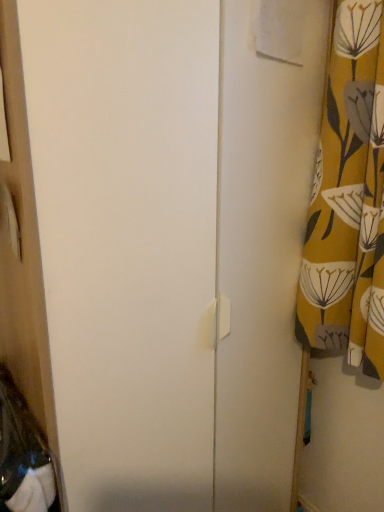
In order to face yellow floral fabric at right, should I rotate leftwards or rightwards?

A 21.200 degree turn to the right will do.

I want to click on yellow floral fabric at right, so click(x=348, y=198).

What is the approximate width of yellow floral fabric at right?

It is 5.99 inches.

What do you see at coordinates (348, 198) in the screenshot? I see `yellow floral fabric at right` at bounding box center [348, 198].

The width and height of the screenshot is (384, 512). What do you see at coordinates (127, 241) in the screenshot?
I see `white matte screen door at center` at bounding box center [127, 241].

Image resolution: width=384 pixels, height=512 pixels. I want to click on white matte screen door at center, so coord(127,241).

Locate an element on the screen. This screenshot has height=512, width=384. yellow floral fabric at right is located at coordinates (348, 198).

Is white matte screen door at center to the right of yellow floral fabric at right from the viewer's perspective?

No, white matte screen door at center is not to the right of yellow floral fabric at right.

Considering the positions of objects white matte screen door at center and yellow floral fabric at right in the image provided, who is behind, white matte screen door at center or yellow floral fabric at right?

yellow floral fabric at right is more distant.

Which is in front, point (119, 274) or point (336, 114)?

The point (119, 274) is more forward.

From the image's perspective, between white matte screen door at center and yellow floral fabric at right, which one is located above?

From the image's view, yellow floral fabric at right is above.

From a real-world perspective, is white matte screen door at center located beneath yellow floral fabric at right?

Yes, from a real-world perspective, white matte screen door at center is under yellow floral fabric at right.

Does white matte screen door at center have a greater width compared to yellow floral fabric at right?

Indeed, white matte screen door at center has a greater width compared to yellow floral fabric at right.

Does white matte screen door at center have a lesser height compared to yellow floral fabric at right?

Incorrect, the height of white matte screen door at center does not fall short of that of yellow floral fabric at right.

Does white matte screen door at center have a smaller size compared to yellow floral fabric at right?

No.

Do you think white matte screen door at center is within yellow floral fabric at right, or outside of it?

white matte screen door at center cannot be found inside yellow floral fabric at right.

Are white matte screen door at center and yellow floral fabric at right making contact?

No.

Is white matte screen door at center positioned with its back to yellow floral fabric at right?

No, white matte screen door at center's orientation is not away from yellow floral fabric at right.

What's the angular difference between white matte screen door at center and yellow floral fabric at right's facing directions?

91.4 degrees.

The width and height of the screenshot is (384, 512). I want to click on curtain that appears on the right of white matte screen door at center, so click(348, 198).

Looking at this image, visually, is yellow floral fabric at right positioned to the left or to the right of white matte screen door at center?

Based on their positions, yellow floral fabric at right is located to the right of white matte screen door at center.

Is yellow floral fabric at right positioned in front of white matte screen door at center?

No, it is not.

Between point (368, 110) and point (207, 60), which one is positioned in front?

The point (207, 60) is closer to the camera.

From the image's perspective, is yellow floral fabric at right located above or below white matte screen door at center?

From the image's perspective, yellow floral fabric at right appears above white matte screen door at center.

From a real-world perspective, is yellow floral fabric at right positioned over white matte screen door at center based on gravity?

Yes, from a real-world perspective, yellow floral fabric at right is on top of white matte screen door at center.

Does yellow floral fabric at right have a lesser width compared to white matte screen door at center?

Correct, the width of yellow floral fabric at right is less than that of white matte screen door at center.

Considering the sizes of objects yellow floral fabric at right and white matte screen door at center in the image provided, who is taller, yellow floral fabric at right or white matte screen door at center?

Standing taller between the two is white matte screen door at center.

Who is bigger, yellow floral fabric at right or white matte screen door at center?

Bigger between the two is white matte screen door at center.

Is yellow floral fabric at right not inside white matte screen door at center?

Indeed, yellow floral fabric at right is completely outside white matte screen door at center.

Would you say yellow floral fabric at right is a long distance from white matte screen door at center?

No, yellow floral fabric at right is not far away from white matte screen door at center.

Is yellow floral fabric at right aimed at white matte screen door at center?

No, yellow floral fabric at right is not aimed at white matte screen door at center.

The height and width of the screenshot is (512, 384). I want to click on screen door in front of the yellow floral fabric at right, so click(x=127, y=241).

In the image, there is a yellow floral fabric at right. Where is `screen door below it (from the image's perspective)`? This screenshot has height=512, width=384. screen door below it (from the image's perspective) is located at coordinates (127, 241).

Where is `screen door on the left of yellow floral fabric at right`? The height and width of the screenshot is (512, 384). screen door on the left of yellow floral fabric at right is located at coordinates (127, 241).